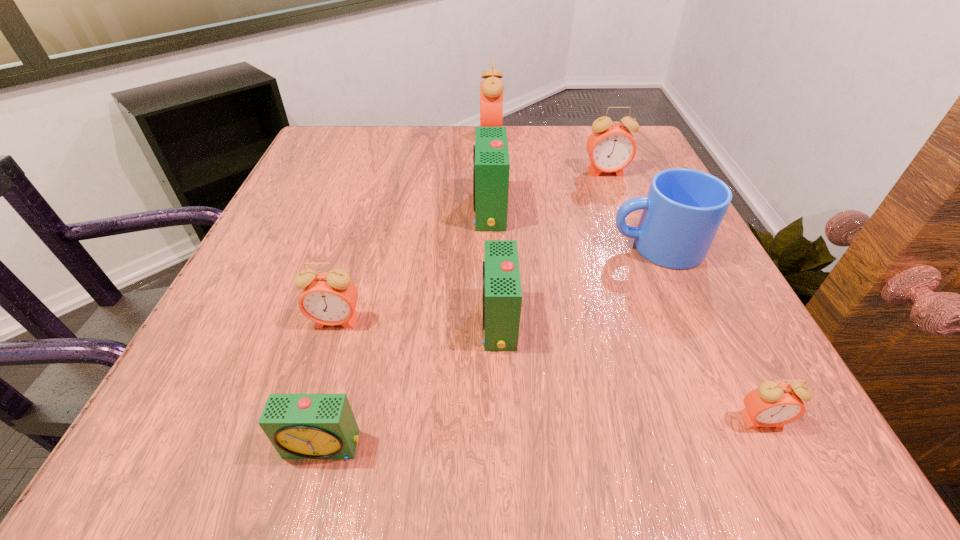
Locate an element on the screen. object at the near right corner is located at coordinates (772, 404).

Locate an element on the screen. This screenshot has width=960, height=540. vacant space at the far edge is located at coordinates tap(527, 156).

Image resolution: width=960 pixels, height=540 pixels. I want to click on free space at the near edge of the desktop, so click(550, 430).

Image resolution: width=960 pixels, height=540 pixels. In the image, there is a desktop. Identify the location of vacant space at the left edge. (299, 202).

Identify the location of vacant area at the right edge. (609, 214).

The width and height of the screenshot is (960, 540). In the image, there is a desktop. In order to click on vacant space at the far left corner in this screenshot , I will do `click(328, 150)`.

The width and height of the screenshot is (960, 540). I want to click on free location at the far right corner of the desktop, so click(x=585, y=147).

This screenshot has width=960, height=540. Identify the location of vacant area that lies between the second smallest green alarm clock and the second farthest object. (552, 247).

You are a GUI agent. You are given a task and a screenshot of the screen. Output one action in this format:
    pyautogui.click(x=<x>, y=<y>)
    Task: Click on the vacant area that lies between the second farthest green alarm clock and the mug
    
    Given the screenshot: What is the action you would take?
    pyautogui.click(x=577, y=285)

Find the location of a particular element. free space between the second smallest green alarm clock and the smallest green alarm clock is located at coordinates (411, 384).